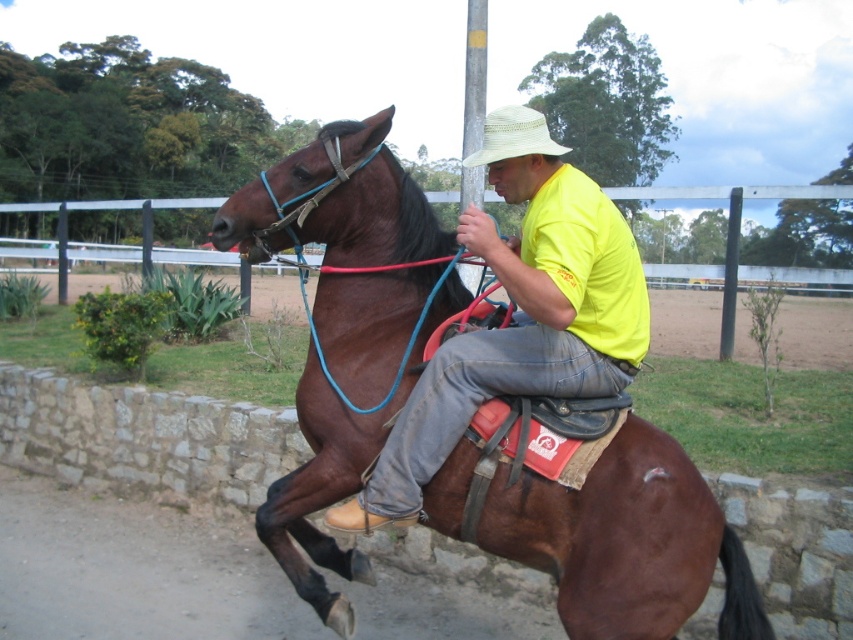
You are a photographer trying to capture a photo of the shiny brown horse at center and the yellow matte shirt at center. Which object should you focus on first if you want to ensure both are in focus, considering their sizes in the frame?

The shiny brown horse at center is taller than the yellow matte shirt at center, so you should focus on the shiny brown horse at center first to ensure both are in focus.

You are a photographer trying to capture the rider and horse in the image. If you want to frame the shiny brown horse at center and the yellow matte shirt at center so that the horse is on the left side of the photo, is the current arrangement suitable?

Yes, the current arrangement is suitable because the shiny brown horse at center is already positioned to the left of the yellow matte shirt at center, which aligns with the desired framing.

You are standing in the field and see a point marked at coordinates point (x=660, y=620). The rider on the horse is 10 feet away from you. Is the point closer to you than the rider?

The point (x=660, y=620) is 8.25 feet from viewer, so yes, the point is closer to you than the rider who is 10 feet away.